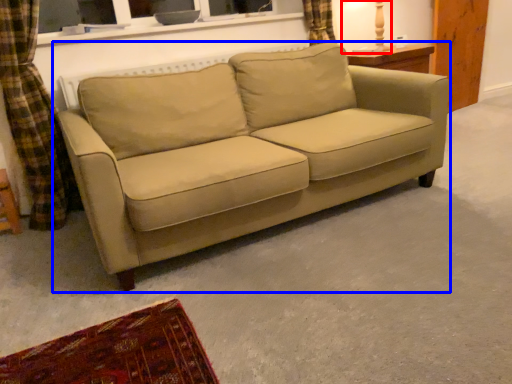
Question: Among these objects, which one is nearest to the camera, table lamp (highlighted by a red box) or studio couch (highlighted by a blue box)?

Choices:
 (A) table lamp
 (B) studio couch

Answer: (B)